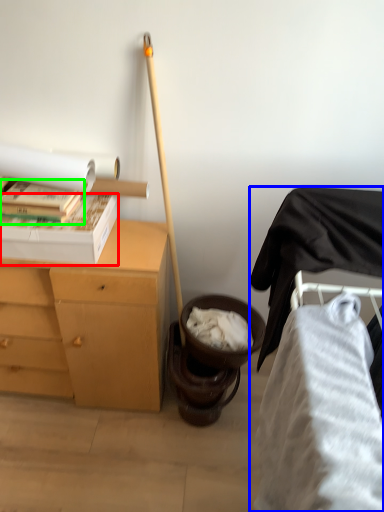
Question: Estimate the real-world distances between objects in this image. Which object is closer to box (highlighted by a red box), furniture (highlighted by a blue box) or book (highlighted by a green box)?

Choices:
 (A) furniture
 (B) book

Answer: (B)